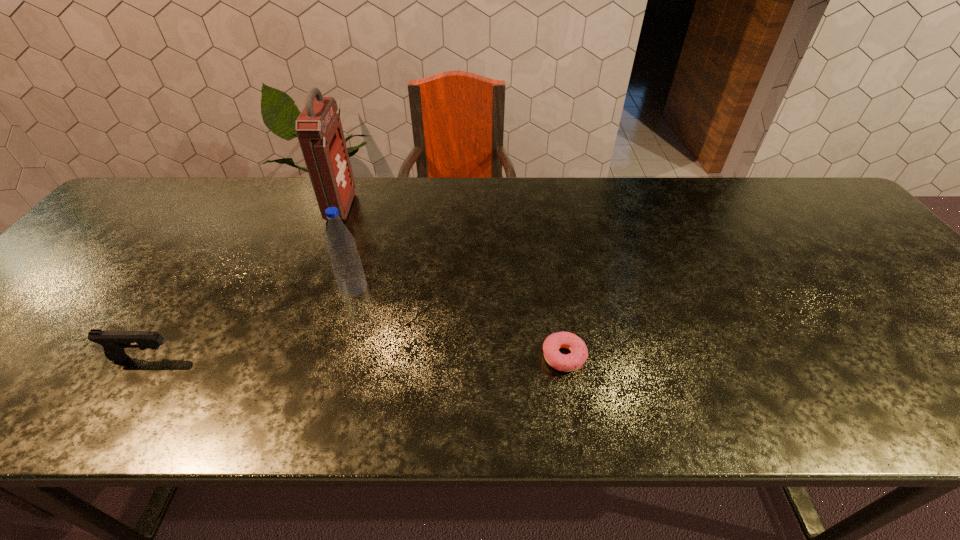
Identify the location of free space located 0.170m at the barrel of the pistol. The height and width of the screenshot is (540, 960). (257, 359).

The width and height of the screenshot is (960, 540). What are the coordinates of `vacant space located 0.390m on the left of the shortest object` in the screenshot? It's located at (355, 357).

Locate an element on the screen. This screenshot has width=960, height=540. object that is positioned at the far edge is located at coordinates (319, 130).

Identify the location of free space at the far edge of the desktop. The width and height of the screenshot is (960, 540). (529, 199).

Where is `free space at the near edge of the desktop`? This screenshot has height=540, width=960. free space at the near edge of the desktop is located at coordinates (35, 402).

Locate an element on the screen. free space at the left edge of the desktop is located at coordinates (29, 314).

Where is `vacant region at the right edge of the desktop`? The width and height of the screenshot is (960, 540). vacant region at the right edge of the desktop is located at coordinates (948, 355).

In the image, there is a desktop. In order to click on free space at the far right corner in this screenshot , I will do `click(771, 192)`.

This screenshot has width=960, height=540. In the image, there is a desktop. Find the location of `free space at the near right corner`. free space at the near right corner is located at coordinates (954, 404).

The image size is (960, 540). Find the location of `free space between the water bottle and the leftmost object`. free space between the water bottle and the leftmost object is located at coordinates (249, 323).